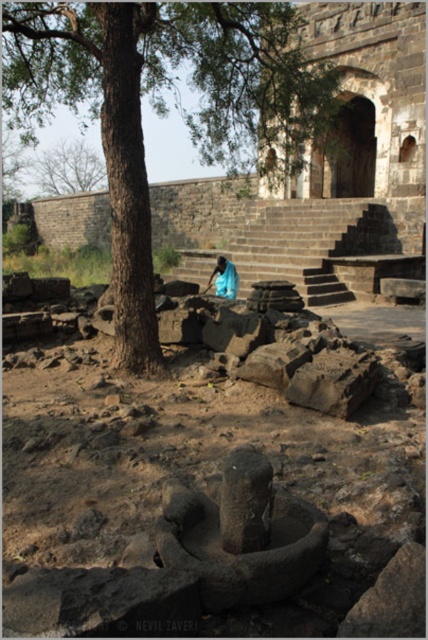
Is brown rough tree at center wider than gray rough stone at center?

Yes.

Does brown rough tree at center have a lesser height compared to gray rough stone at center?

No.

The width and height of the screenshot is (428, 640). Find the location of `brown rough tree at center`. brown rough tree at center is located at coordinates pyautogui.click(x=165, y=106).

Is brown earthy dirt field at center thinner than gray rough stone at center?

Result: No, brown earthy dirt field at center is not thinner than gray rough stone at center.

Is brown earthy dirt field at center above gray rough stone at center?

Actually, brown earthy dirt field at center is below gray rough stone at center.

Between point (95, 374) and point (258, 340), which one is positioned behind?

Positioned behind is point (95, 374).

Identify the location of brown earthy dirt field at center. (211, 497).

How far apart are brown earthy dirt field at center and blue fabric person at center?

brown earthy dirt field at center is 7.56 meters away from blue fabric person at center.

In the scene shown: Is brown earthy dirt field at center taller than blue fabric person at center?

In fact, brown earthy dirt field at center may be shorter than blue fabric person at center.

At what (x,y) coordinates should I click in order to perform the action: click on brown earthy dirt field at center. Please return your answer as a coordinate pair (x, y). The height and width of the screenshot is (640, 428). Looking at the image, I should click on (211, 497).